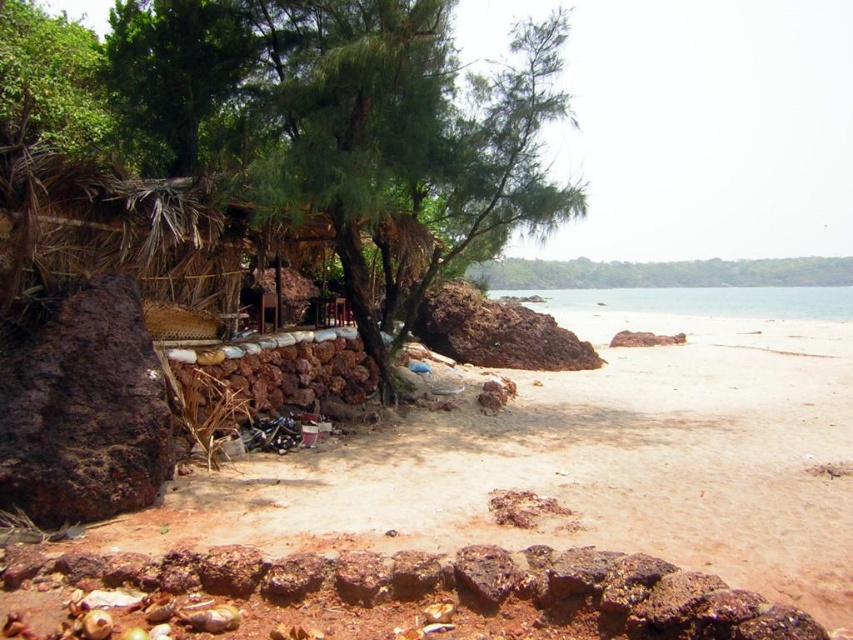
Does brown rock at left come behind rusty stone wall at lower left?

Yes, brown rock at left is behind rusty stone wall at lower left.

I want to click on brown rock at left, so click(x=601, y=461).

You are a GUI agent. You are given a task and a screenshot of the screen. Output one action in this format:
    pyautogui.click(x=<x>, y=<y>)
    Task: Click on the brown rock at left
    
    Given the screenshot: What is the action you would take?
    pyautogui.click(x=601, y=461)

Is green leafy tree at left below brown rock at left?

No.

This screenshot has height=640, width=853. Describe the element at coordinates (282, 150) in the screenshot. I see `green leafy tree at left` at that location.

Which is behind, point (271, 250) or point (514, 532)?

Positioned behind is point (271, 250).

You are a GUI agent. You are given a task and a screenshot of the screen. Output one action in this format:
    pyautogui.click(x=<x>, y=<y>)
    Task: Click on the green leafy tree at left
    
    Given the screenshot: What is the action you would take?
    pyautogui.click(x=282, y=150)

Can you confirm if green leafy tree at left is taller than clear water at right?

Yes, green leafy tree at left is taller than clear water at right.

Does point (141, 272) lie behind point (628, 310)?

No, it is in front of (628, 310).

Identify the location of green leafy tree at left. The width and height of the screenshot is (853, 640). (282, 150).